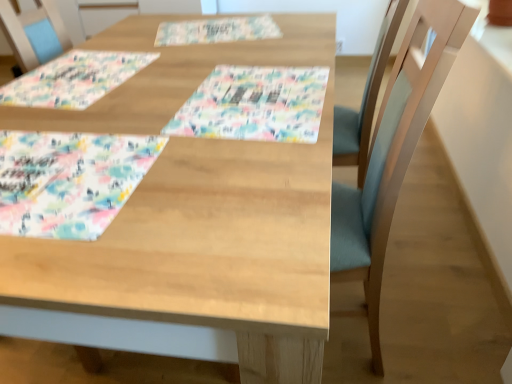
Locate an element on the screen. vacant space behind watercolor fabric placemat at center is located at coordinates (266, 62).